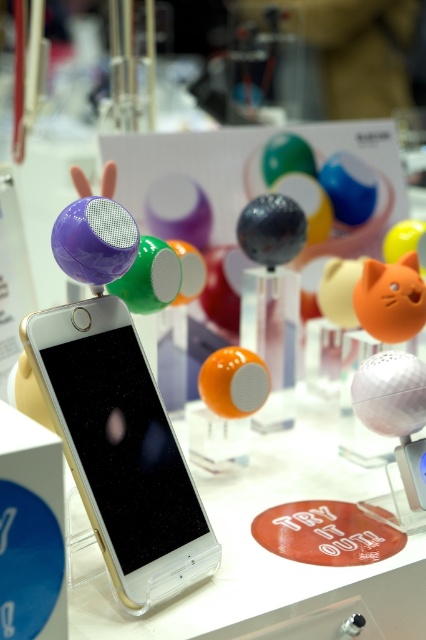
You are a photographer trying to capture the smartphone on the transparent stand. You notice two points marked in the image. The first point is at coordinates point (74, 368) and the second point is at point (379, 308). Which point is nearer to your camera lens when focusing on the smartphone?

Point (74, 368) is closer to the camera than point (379, 308), so the first point is nearer to your camera lens when focusing on the smartphone.